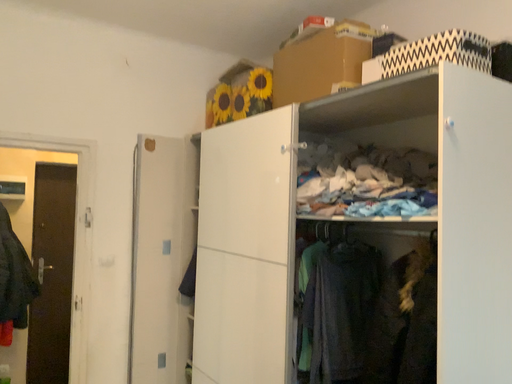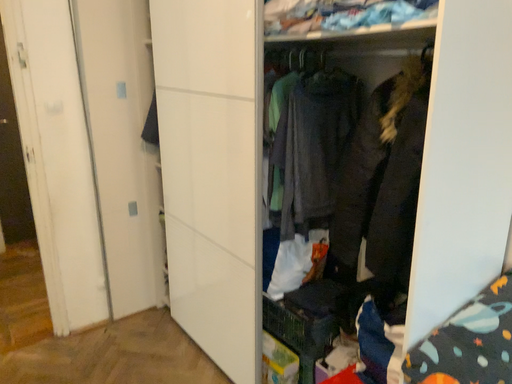
Question: Which way did the camera rotate in the video?

Choices:
 (A) rotated downward
 (B) rotated upward

Answer: (A)